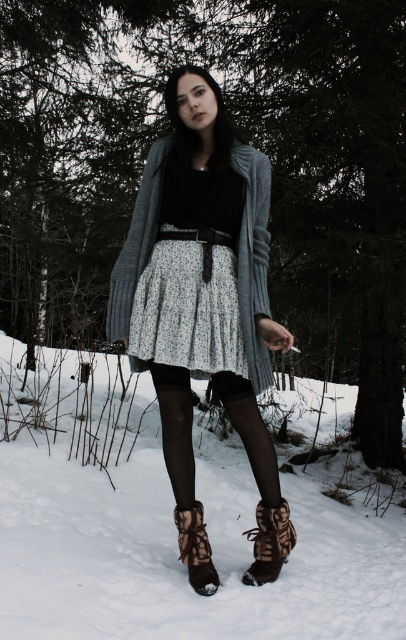
Question: Is the position of knitted gray cardigan at center more distant than that of brown fur boot at lower center?

Choices:
 (A) yes
 (B) no

Answer: (B)

Question: Which object is farther from the camera taking this photo?

Choices:
 (A) brown fur boot at lower center
 (B) floral-patterned skirt at center
 (C) black sheer tights at center

Answer: (A)

Question: Among these objects, which one is farthest from the camera?

Choices:
 (A) floral-patterned fabric skirt at center
 (B) brown fur boot at lower center
 (C) floral-patterned skirt at center
 (D) black sheer tights at center

Answer: (B)

Question: From the image, what is the correct spatial relationship of brown fur boot at lower center in relation to leopard print suede boot at lower center?

Choices:
 (A) above
 (B) below

Answer: (B)

Question: Can you confirm if white fluffy snow at lower center is positioned below floral-patterned fabric skirt at center?

Choices:
 (A) yes
 (B) no

Answer: (A)

Question: Which point is closer to the camera?

Choices:
 (A) (164, 442)
 (B) (218, 260)
 (C) (161, 285)

Answer: (C)